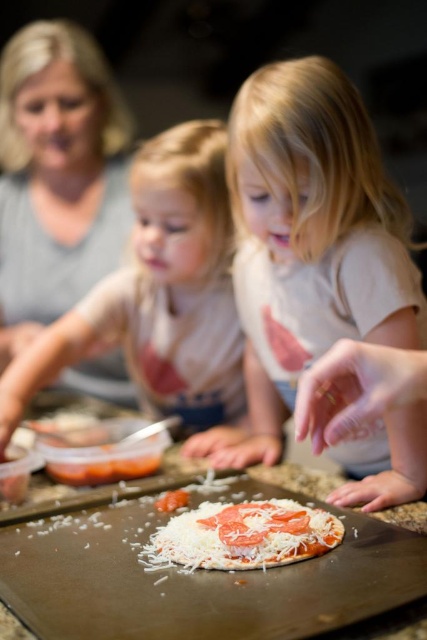
You are a chef preparing a pizza. You have a white cotton shirt at center and a white cheese pizza at center in front of you. Which item is wider?

The white cotton shirt at center is wider than the white cheese pizza at center.

Based on the photo, you are a chef who needs to place a pizza on the counter. The counter is 1 meter tall. Can the white matte baking sheet at center fit under the matte gray shirt at upper left without touching it?

The white matte baking sheet at center is not as tall as matte gray shirt at upper left, so it can fit under the matte gray shirt at upper left without touching it as long as there is enough vertical space between them.

You are a chef preparing a pizza. You have a white cheese pizza at center that needs to be placed on a baking surface. Given that the white matte baking sheet at center is available, will the pizza fit on it without overhanging?

The white matte baking sheet at center is larger in size than the white cheese pizza at center, so the pizza will fit on it without overhanging.